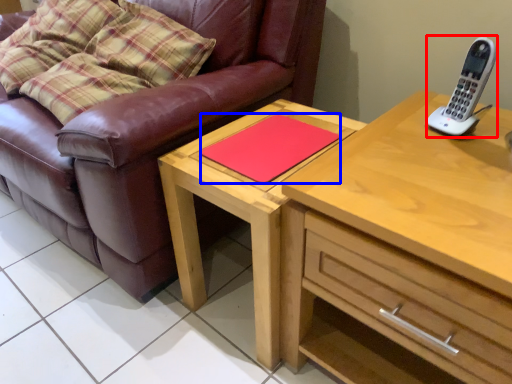
Question: Which object appears closest to the camera in this image, gadget (highlighted by a red box) or pad (highlighted by a blue box)?

Choices:
 (A) gadget
 (B) pad

Answer: (A)